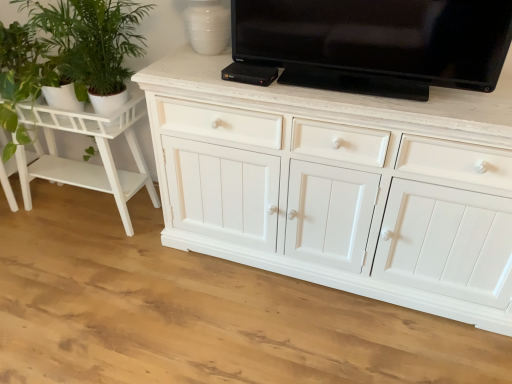
In order to click on free space in front of white painted wood side table at left in this screenshot , I will do `click(74, 268)`.